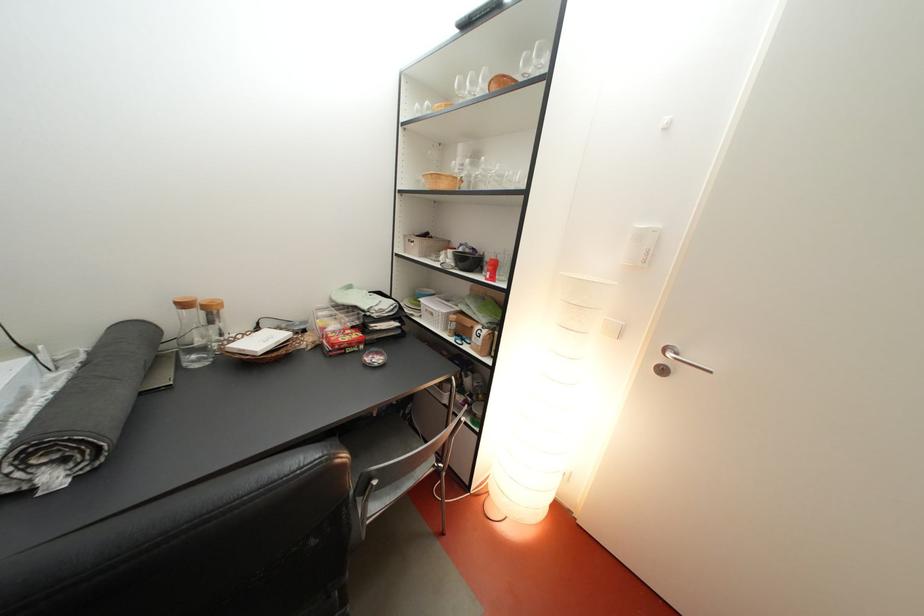
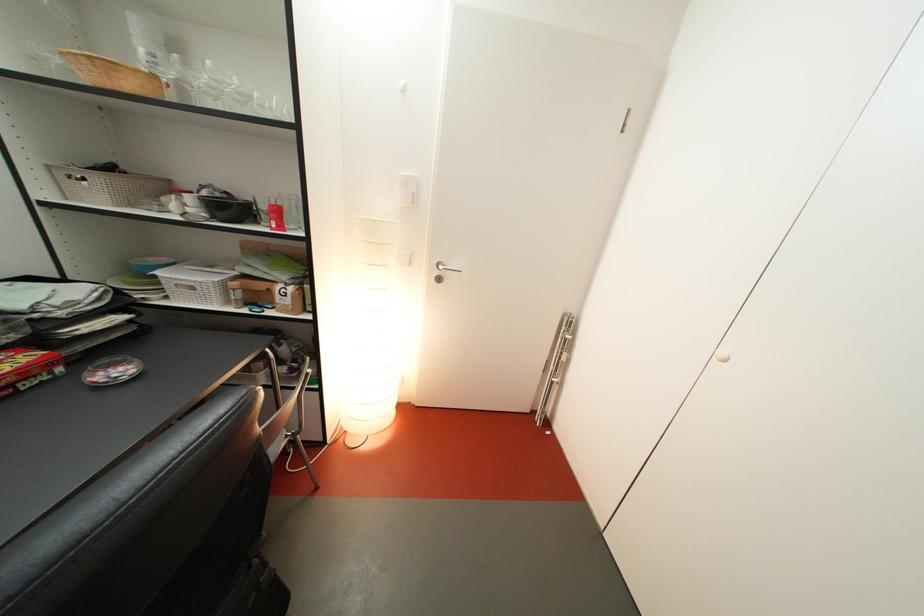
The point at (496, 274) is marked in the first image. Where is the corresponding point in the second image?

(275, 223)